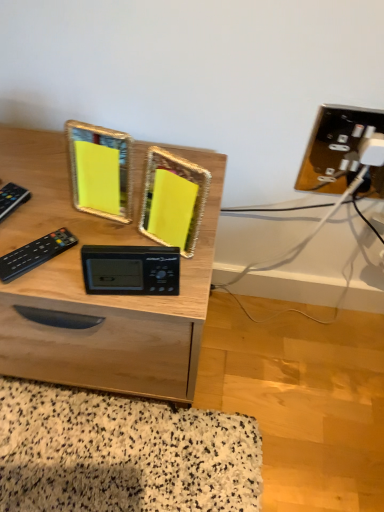
Question: Considering the relative sizes of black plastic remote at left, the 1th control viewed from the left, and black plastic remote at left, arranged as the second control when viewed from the left, in the image provided, is black plastic remote at left, the 1th control viewed from the left, wider than black plastic remote at left, arranged as the second control when viewed from the left,?

Choices:
 (A) yes
 (B) no

Answer: (A)

Question: Is black plastic remote at left, which ranks as the second control in right-to-left order, turned away from black plastic remote at left, the first control viewed from the right?

Choices:
 (A) no
 (B) yes

Answer: (A)

Question: From the image's perspective, would you say black plastic remote at left, which ranks as the second control in right-to-left order, is positioned over black plastic remote at left, arranged as the second control when viewed from the left?

Choices:
 (A) yes
 (B) no

Answer: (A)

Question: Is black plastic remote at left, which ranks as the second control in right-to-left order, smaller than black plastic remote at left, arranged as the second control when viewed from the left?

Choices:
 (A) yes
 (B) no

Answer: (B)

Question: Could you tell me if black plastic remote at left, the 1th control viewed from the left, is facing black plastic remote at left, arranged as the second control when viewed from the left?

Choices:
 (A) no
 (B) yes

Answer: (A)

Question: Is the surface of black plastic remote at left, which ranks as the second control in right-to-left order, in direct contact with black plastic remote at left, arranged as the second control when viewed from the left?

Choices:
 (A) no
 (B) yes

Answer: (A)

Question: Is black plastic remote at left, which ranks as the second control in right-to-left order, not within black plastic clock at center?

Choices:
 (A) yes
 (B) no

Answer: (A)

Question: Does black plastic remote at left, which ranks as the second control in right-to-left order, have a smaller size compared to black plastic clock at center?

Choices:
 (A) yes
 (B) no

Answer: (A)

Question: Is black plastic remote at left, which ranks as the second control in right-to-left order, shorter than black plastic clock at center?

Choices:
 (A) yes
 (B) no

Answer: (A)

Question: Considering the relative sizes of black plastic remote at left, the 1th control viewed from the left, and black plastic clock at center in the image provided, is black plastic remote at left, the 1th control viewed from the left, wider than black plastic clock at center?

Choices:
 (A) no
 (B) yes

Answer: (B)

Question: Is black plastic remote at left, the 1th control viewed from the left, oriented away from black plastic clock at center?

Choices:
 (A) yes
 (B) no

Answer: (B)

Question: Is black plastic remote at left, which ranks as the second control in right-to-left order, at the left side of black plastic clock at center?

Choices:
 (A) no
 (B) yes

Answer: (B)

Question: Is black plastic remote at left, the first control viewed from the right, facing towards black plastic clock at center?

Choices:
 (A) no
 (B) yes

Answer: (A)